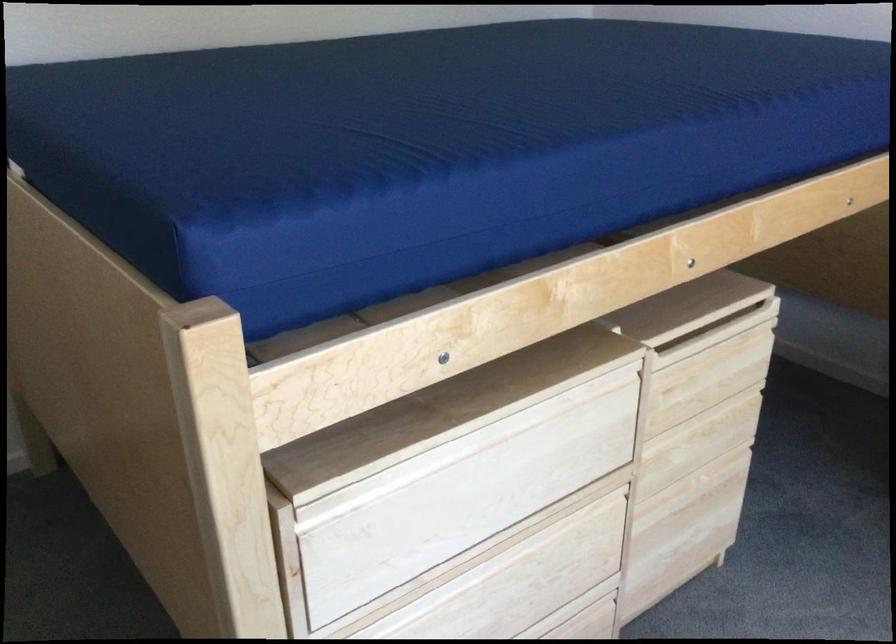
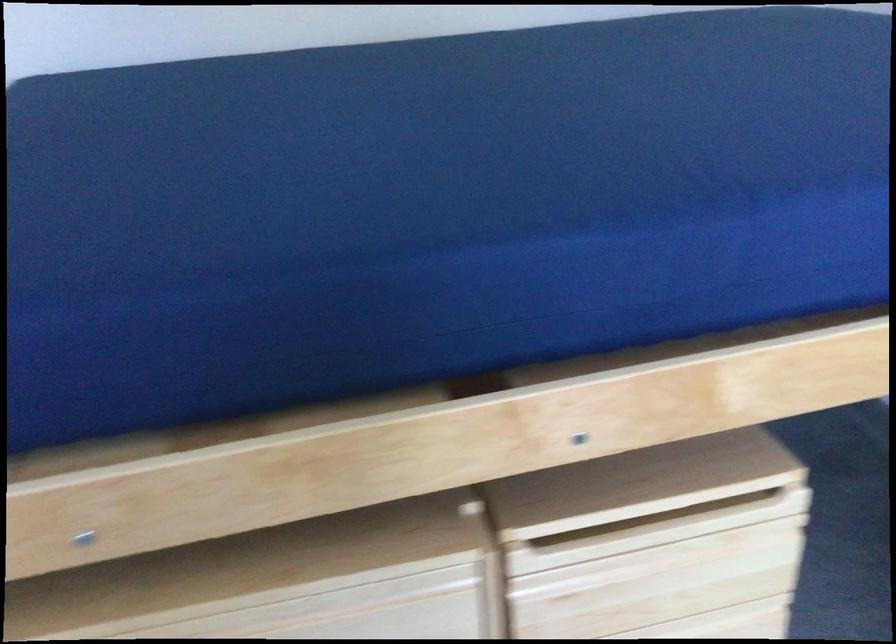
Find the pixel in the second image that matches the point at 564,118 in the first image.

(431, 210)